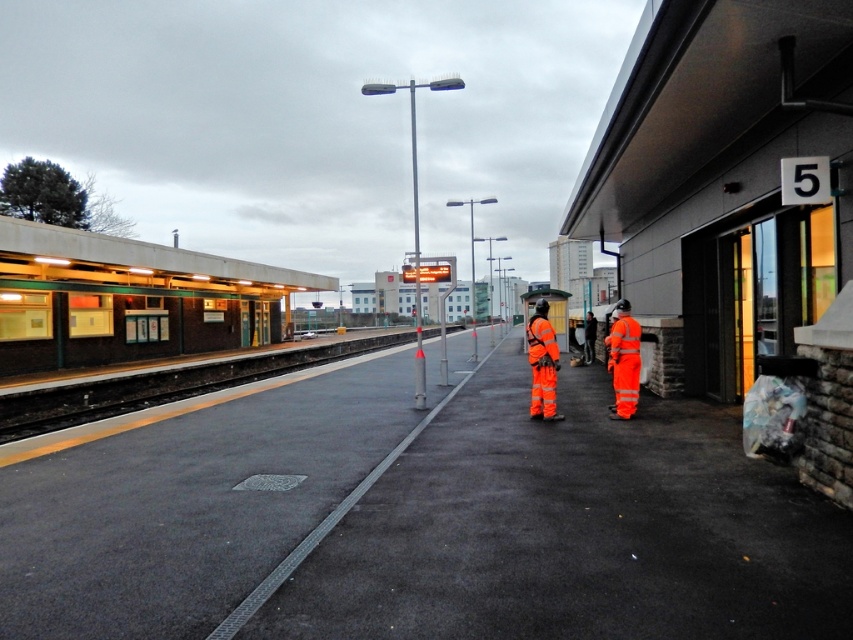
Question: Can you confirm if high-visibility orange jumpsuit at right is thinner than high visibility orange reflective jacket at center?

Choices:
 (A) no
 (B) yes

Answer: (B)

Question: Which of these objects is positioned farthest from the orange reflective safety vest at center?

Choices:
 (A) high-visibility orange jumpsuit at right
 (B) high visibility orange reflective jacket at center

Answer: (A)

Question: In this image, where is high-visibility orange jumpsuit at right located relative to high visibility orange reflective jacket at center?

Choices:
 (A) below
 (B) above

Answer: (A)

Question: Estimate the real-world distances between objects in this image. Which object is closer to the high-visibility orange jumpsuit at right?

Choices:
 (A) high visibility orange reflective jacket at center
 (B) orange reflective safety vest at center

Answer: (A)

Question: Considering the real-world distances, which object is farthest from the orange reflective safety vest at center?

Choices:
 (A) high visibility orange reflective jacket at center
 (B) high-visibility orange jumpsuit at right

Answer: (B)

Question: Can you confirm if high-visibility orange jumpsuit at right is positioned to the left of high visibility orange reflective jacket at center?

Choices:
 (A) yes
 (B) no

Answer: (B)